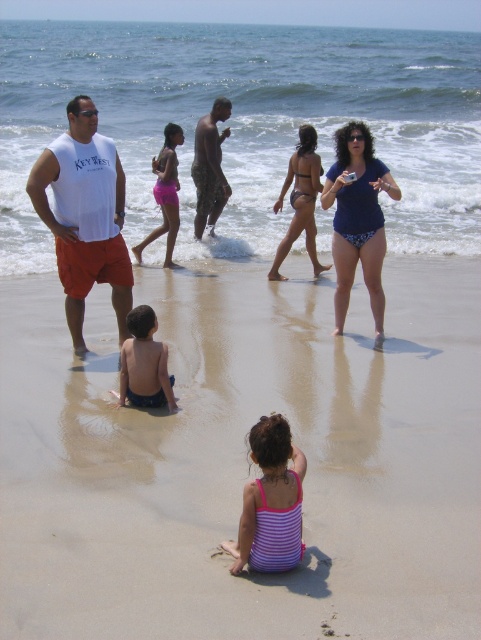
Who is lower down, matte bikini at center or pink fabric shorts at center?

matte bikini at center

Is matte bikini at center taller than pink fabric shorts at center?

Indeed, matte bikini at center has a greater height compared to pink fabric shorts at center.

Measure the distance between matte bikini at center and camera.

A distance of 29.39 feet exists between matte bikini at center and camera.

Where is `matte bikini at center`? This screenshot has height=640, width=481. matte bikini at center is located at coordinates (301, 200).

Which is in front, point (334, 307) or point (251, 547)?

Point (251, 547) is more forward.

This screenshot has width=481, height=640. What do you see at coordinates (357, 220) in the screenshot? I see `blue printed bikini at center` at bounding box center [357, 220].

Who is more forward, (x=320, y=196) or (x=291, y=502)?

Point (x=291, y=502) is in front.

Where is `blue printed bikini at center`? The height and width of the screenshot is (640, 481). blue printed bikini at center is located at coordinates (357, 220).

Can you confirm if light brown skin at center is positioned to the right of matte bikini at center?

In fact, light brown skin at center is to the left of matte bikini at center.

Consider the image. Is light brown skin at center below matte bikini at center?

Indeed, light brown skin at center is positioned under matte bikini at center.

Is point (125, 349) positioned before point (291, 163)?

Yes, point (125, 349) is closer to viewer.

The width and height of the screenshot is (481, 640). What are the coordinates of `light brown skin at center` in the screenshot? It's located at (144, 364).